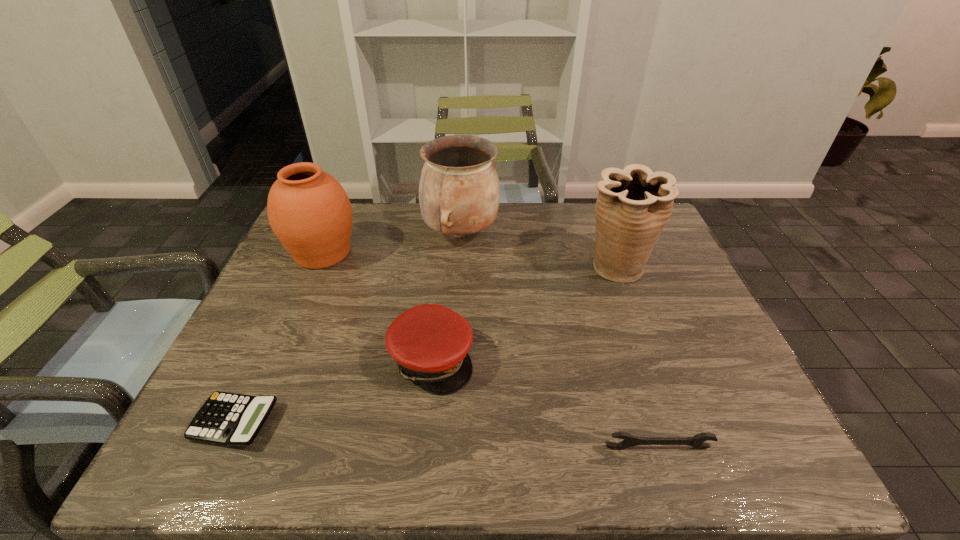
Locate an element on the screen. free space between the second urn from right to left and the leftmost urn is located at coordinates (392, 243).

At what (x,y) coordinates should I click in order to perform the action: click on blank region between the shortest object and the fifth tallest object. Please return your answer as a coordinate pair (x, y). Looking at the image, I should click on (446, 435).

This screenshot has width=960, height=540. What are the coordinates of `vacant area that lies between the second urn from right to left and the leftmost urn` in the screenshot? It's located at (392, 243).

Identify which object is located as the fourth nearest to the leftmost urn. Please provide its 2D coordinates. Your answer should be formatted as a tuple, i.e. [(x, y)], where the tuple contains the x and y coordinates of a point satisfying the conditions above.

[(634, 204)]

Find the location of a particular element. The image size is (960, 540). the fifth closest object to the rightmost urn is located at coordinates (230, 419).

Where is `urn that can be found as the second closest to the second urn from left to right`? urn that can be found as the second closest to the second urn from left to right is located at coordinates (634, 204).

Select which urn appears as the second closest to the wrench. Please provide its 2D coordinates. Your answer should be formatted as a tuple, i.e. [(x, y)], where the tuple contains the x and y coordinates of a point satisfying the conditions above.

[(459, 193)]